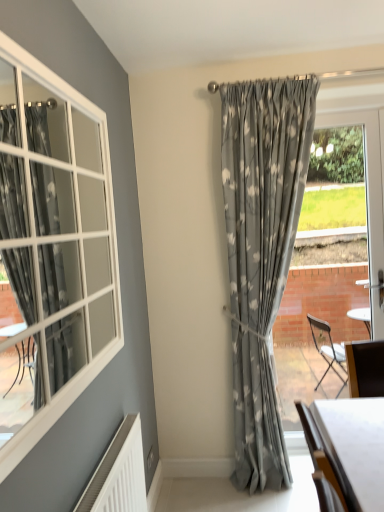
Question: From a real-world perspective, is white glossy table at lower right on matte gray curtain at center?

Choices:
 (A) no
 (B) yes

Answer: (A)

Question: Is white glossy table at lower right oriented towards matte gray curtain at center?

Choices:
 (A) no
 (B) yes

Answer: (A)

Question: Are white glossy table at lower right and matte gray curtain at center located far from each other?

Choices:
 (A) yes
 (B) no

Answer: (B)

Question: From a real-world perspective, does white glossy table at lower right sit lower than matte gray curtain at center?

Choices:
 (A) yes
 (B) no

Answer: (A)

Question: Does white glossy table at lower right have a lesser width compared to matte gray curtain at center?

Choices:
 (A) yes
 (B) no

Answer: (B)

Question: Considering the relative positions of white glossy table at lower right and matte gray curtain at center in the image provided, is white glossy table at lower right in front of matte gray curtain at center?

Choices:
 (A) yes
 (B) no

Answer: (A)

Question: Is matte gray curtain at center bigger than white glossy table at lower right?

Choices:
 (A) no
 (B) yes

Answer: (B)

Question: Is white glossy table at lower right at the back of matte gray curtain at center?

Choices:
 (A) no
 (B) yes

Answer: (B)

Question: Is matte gray curtain at center positioned far away from white glossy table at lower right?

Choices:
 (A) yes
 (B) no

Answer: (B)

Question: Is white glossy table at lower right completely or partially inside matte gray curtain at center?

Choices:
 (A) no
 (B) yes

Answer: (A)

Question: Is matte gray curtain at center thinner than white glossy table at lower right?

Choices:
 (A) no
 (B) yes

Answer: (B)

Question: Does matte gray curtain at center appear on the left side of white glossy table at lower right?

Choices:
 (A) no
 (B) yes

Answer: (B)

Question: From a real-world perspective, is white glossy table at lower right under clear glass door at right?

Choices:
 (A) no
 (B) yes

Answer: (B)